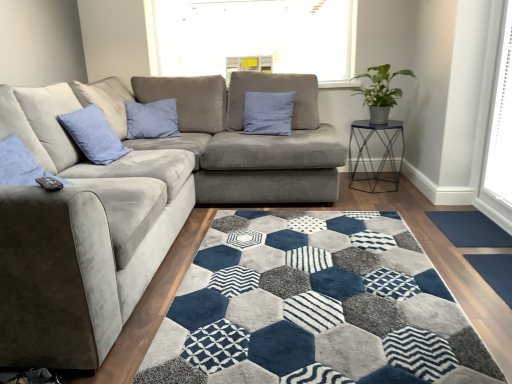
Question: Is green matte plant at upper right taller or shorter than dark gray rubber doormat at lower right, positioned as the second doormat in top-to-bottom order?

Choices:
 (A) tall
 (B) short

Answer: (A)

Question: Looking at the image, does green matte plant at upper right seem bigger or smaller compared to dark gray rubber doormat at lower right, the 1th doormat viewed from the front?

Choices:
 (A) small
 (B) big

Answer: (B)

Question: Based on their relative distances, which object is nearer to the dark gray rubber doormat at lower right, the 1th doormat viewed from the front?

Choices:
 (A) blue velvet pillow at upper left, the 2th pillow when ordered from right to left
 (B) white plastic blinds at right
 (C) dark blue textured mat at lower right, the 1th doormat from the back
 (D) metallic hexagonal table at right
 (E) suede gray futon at center

Answer: (C)

Question: Which object is positioned closest to the dark gray rubber doormat at lower right, which is counted as the 1th doormat, starting from the bottom?

Choices:
 (A) blue velvet pillow at center, placed as the 2th pillow when sorted from front to back
 (B) suede gray futon at center
 (C) white plastic blinds at right
 (D) metallic hexagonal table at right
 (E) velvet gray couch at center

Answer: (C)